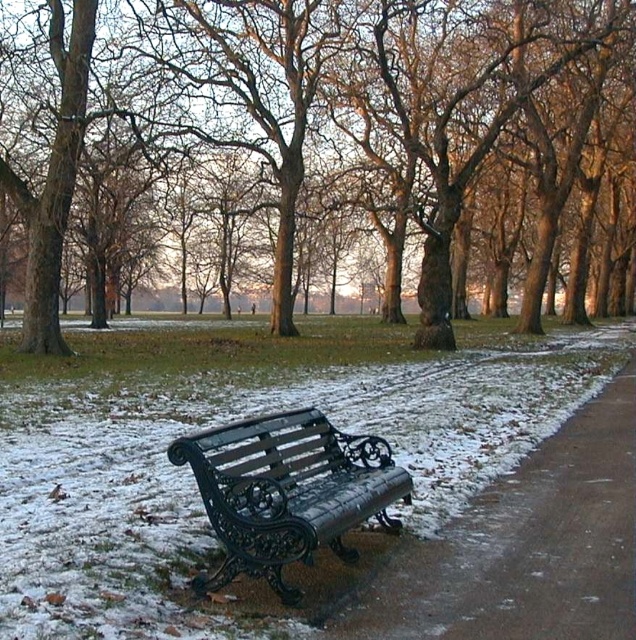
In the scene shown: You are a delivery person trying to deliver a package to the metal bench at center. However, you notice the smooth brown tree trunk at center is blocking the path. Can you reach the bench without moving the tree?

The metal bench at center is behind the smooth brown tree trunk at center, so you can go around the tree to reach the bench.

You are standing at the point marked as point (523, 61) in the winter park scene. If you want to take a photo of the entire bench and the pathway, which direction should you move to ensure both are fully in the frame?

Since the point (523, 61) is 28.44 meters away from the camera, you should move closer to the camera to ensure both the bench and the pathway are fully visible in the frame.